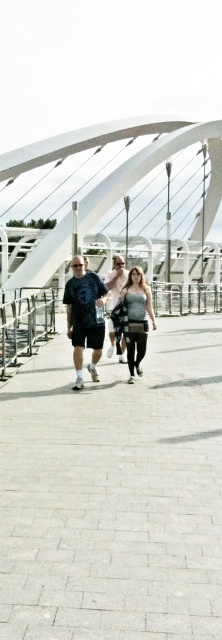
Which is above, white glossy pedestrian bridge at center or light pink cotton shirt at center?

Positioned higher is white glossy pedestrian bridge at center.

Is point (45, 244) farther from viewer compared to point (114, 272)?

Yes, it is behind point (114, 272).

The image size is (222, 640). In order to click on white glossy pedestrian bridge at center in this screenshot , I will do `click(138, 170)`.

Is matte black t-shirt at center wider than light pink cotton shirt at center?

Indeed, matte black t-shirt at center has a greater width compared to light pink cotton shirt at center.

Between matte black t-shirt at center and light pink cotton shirt at center, which one appears on the right side from the viewer's perspective?

Positioned to the right is light pink cotton shirt at center.

Who is more forward, [95,310] or [116,276]?

Point [95,310] is more forward.

The height and width of the screenshot is (640, 222). What are the coordinates of `matte black t-shirt at center` in the screenshot? It's located at (83, 316).

Is white glossy pedestrian bridge at center to the left of matte black shorts at center from the viewer's perspective?

No, white glossy pedestrian bridge at center is not to the left of matte black shorts at center.

This screenshot has height=640, width=222. In order to click on white glossy pedestrian bridge at center in this screenshot , I will do `click(138, 170)`.

Between point (19, 278) and point (67, 332), which one is positioned in front?

Positioned in front is point (67, 332).

Locate an element on the screen. The image size is (222, 640). white glossy pedestrian bridge at center is located at coordinates (138, 170).